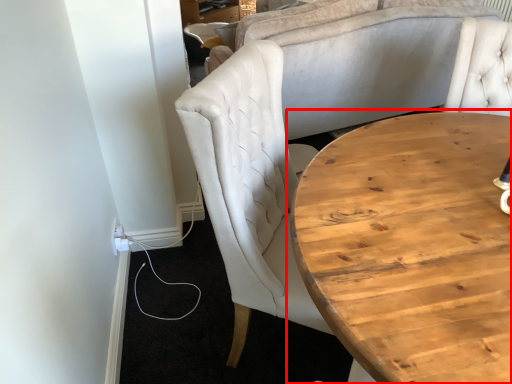
Question: From the image, what is the correct spatial relationship of coffee table (annotated by the red box) in relation to chair?

Choices:
 (A) left
 (B) right

Answer: (B)